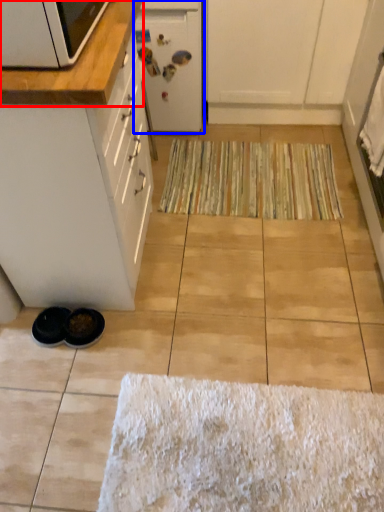
Question: Which of the following is the closest to the observer, countertop (highlighted by a red box) or appliance (highlighted by a blue box)?

Choices:
 (A) countertop
 (B) appliance

Answer: (A)